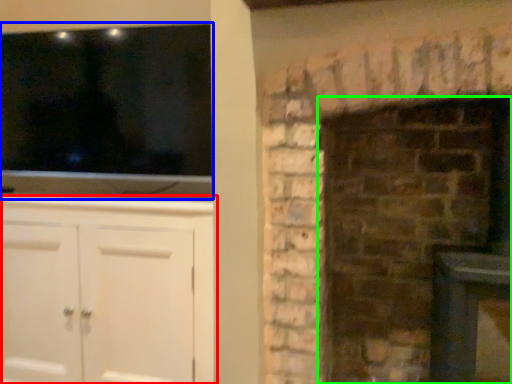
Question: Which object is the farthest from cabinetry (highlighted by a red box)? Choose among these: window (highlighted by a blue box) or fireplace (highlighted by a green box).

Choices:
 (A) window
 (B) fireplace

Answer: (B)